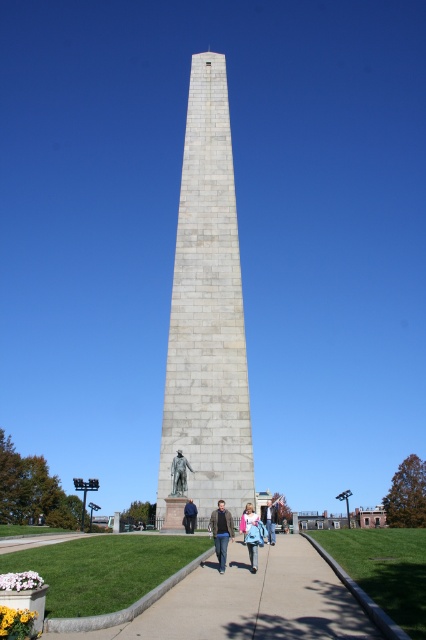
Who is positioned more to the right, white stone obelisk at center or denim jacket at lower center?

Positioned to the right is denim jacket at lower center.

Can you confirm if white stone obelisk at center is positioned to the right of denim jacket at lower center?

Incorrect, white stone obelisk at center is not on the right side of denim jacket at lower center.

I want to click on white stone obelisk at center, so click(x=207, y=314).

Is blue denim jacket at lower center further to the viewer compared to light blue denim jeans at lower center?

That is False.

Is blue denim jacket at lower center thinner than light blue denim jeans at lower center?

Correct, blue denim jacket at lower center's width is less than light blue denim jeans at lower center's.

Measure the distance between blue denim jacket at lower center and camera.

They are 22.33 meters apart.

Identify the location of blue denim jacket at lower center. (253, 538).

Which is more to the left, polished bronze statue at center or blue denim jeans at lower center?

Positioned to the left is polished bronze statue at center.

Who is more forward, (187,467) or (261,515)?

Point (187,467) is in front.

The height and width of the screenshot is (640, 426). I want to click on polished bronze statue at center, so click(178, 474).